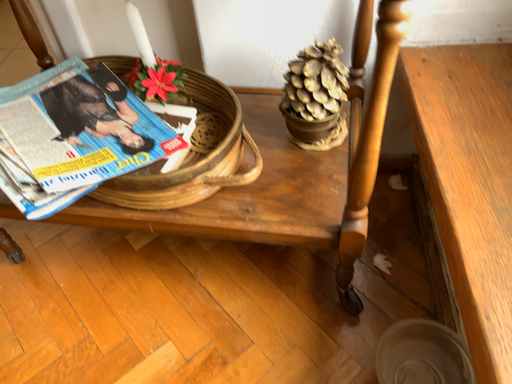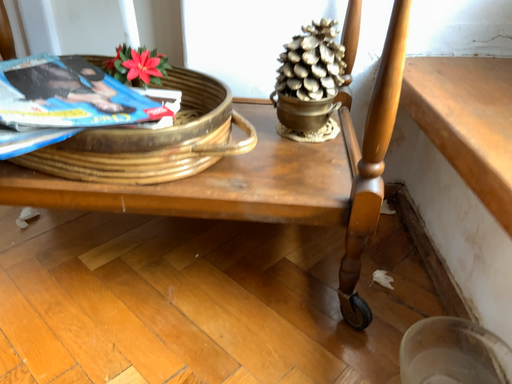
Question: How did the camera likely rotate when shooting the video?

Choices:
 (A) rotated downward
 (B) rotated upward

Answer: (B)